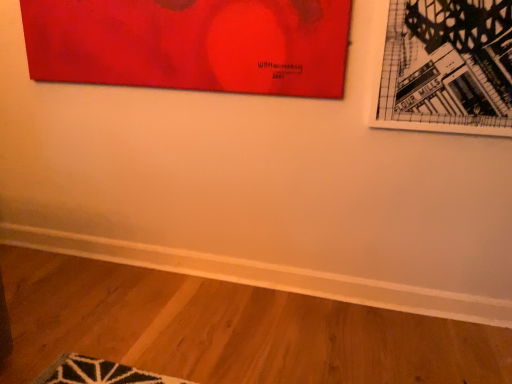
How much space does matte red painting at upper left, acting as the 2th picture frame starting from the right, occupy horizontally?

1.95 inches.

Locate an element on the screen. This screenshot has width=512, height=384. matte red painting at upper left, acting as the 2th picture frame starting from the right is located at coordinates (192, 44).

What do you see at coordinates (192, 44) in the screenshot? I see `matte red painting at upper left, acting as the 2th picture frame starting from the right` at bounding box center [192, 44].

Find the location of a particular element. The width and height of the screenshot is (512, 384). black paper picture frame at upper right, the second picture frame positioned from the left is located at coordinates (447, 67).

Image resolution: width=512 pixels, height=384 pixels. Describe the element at coordinates (447, 67) in the screenshot. I see `black paper picture frame at upper right, the second picture frame positioned from the left` at that location.

How much space does black paper picture frame at upper right, the second picture frame positioned from the left, occupy horizontally?

It is 1.82 inches.

Locate an element on the screen. This screenshot has width=512, height=384. matte red painting at upper left, the first picture frame in the left-to-right sequence is located at coordinates (192, 44).

Considering the relative positions of black paper picture frame at upper right, the second picture frame positioned from the left, and matte red painting at upper left, acting as the 2th picture frame starting from the right, in the image provided, is black paper picture frame at upper right, the second picture frame positioned from the left, to the right of matte red painting at upper left, acting as the 2th picture frame starting from the right, from the viewer's perspective?

Correct, you'll find black paper picture frame at upper right, the second picture frame positioned from the left, to the right of matte red painting at upper left, acting as the 2th picture frame starting from the right.

Is black paper picture frame at upper right, the second picture frame positioned from the left, in front of or behind matte red painting at upper left, the first picture frame in the left-to-right sequence, in the image?

Clearly, black paper picture frame at upper right, the second picture frame positioned from the left, is in front of matte red painting at upper left, the first picture frame in the left-to-right sequence.

Is point (400, 111) positioned after point (270, 37)?

No, it is in front of (270, 37).

From the image's perspective, which object appears higher, black paper picture frame at upper right, the second picture frame positioned from the left, or matte red painting at upper left, acting as the 2th picture frame starting from the right?

matte red painting at upper left, acting as the 2th picture frame starting from the right.

From a real-world perspective, which is physically above, black paper picture frame at upper right, which is the first picture frame from right to left, or matte red painting at upper left, acting as the 2th picture frame starting from the right?

matte red painting at upper left, acting as the 2th picture frame starting from the right, is physically above.

Which object is thinner, black paper picture frame at upper right, the second picture frame positioned from the left, or matte red painting at upper left, the first picture frame in the left-to-right sequence?

With smaller width is black paper picture frame at upper right, the second picture frame positioned from the left.

Considering the relative sizes of black paper picture frame at upper right, which is the first picture frame from right to left, and matte red painting at upper left, the first picture frame in the left-to-right sequence, in the image provided, is black paper picture frame at upper right, which is the first picture frame from right to left, taller than matte red painting at upper left, the first picture frame in the left-to-right sequence,?

Correct, black paper picture frame at upper right, which is the first picture frame from right to left, is much taller as matte red painting at upper left, the first picture frame in the left-to-right sequence.

Considering the relative sizes of black paper picture frame at upper right, which is the first picture frame from right to left, and matte red painting at upper left, the first picture frame in the left-to-right sequence, in the image provided, is black paper picture frame at upper right, which is the first picture frame from right to left, smaller than matte red painting at upper left, the first picture frame in the left-to-right sequence,?

Yes, black paper picture frame at upper right, which is the first picture frame from right to left, is smaller than matte red painting at upper left, the first picture frame in the left-to-right sequence.

Would you say black paper picture frame at upper right, the second picture frame positioned from the left, is outside matte red painting at upper left, acting as the 2th picture frame starting from the right?

Yes.

Looking at this image, is black paper picture frame at upper right, which is the first picture frame from right to left, touching matte red painting at upper left, acting as the 2th picture frame starting from the right?

They are not placed beside each other.

Is black paper picture frame at upper right, the second picture frame positioned from the left, aimed at matte red painting at upper left, acting as the 2th picture frame starting from the right?

No, black paper picture frame at upper right, the second picture frame positioned from the left, is not aimed at matte red painting at upper left, acting as the 2th picture frame starting from the right.

How distant is black paper picture frame at upper right, which is the first picture frame from right to left, from matte red painting at upper left, acting as the 2th picture frame starting from the right?

black paper picture frame at upper right, which is the first picture frame from right to left, and matte red painting at upper left, acting as the 2th picture frame starting from the right, are 16.94 inches apart from each other.

You are a GUI agent. You are given a task and a screenshot of the screen. Output one action in this format:
    pyautogui.click(x=<x>, y=<y>)
    Task: Click on the picture frame on the right of matte red painting at upper left, the first picture frame in the left-to-right sequence
    Image resolution: width=512 pixels, height=384 pixels.
    Given the screenshot: What is the action you would take?
    pyautogui.click(x=447, y=67)

Between matte red painting at upper left, the first picture frame in the left-to-right sequence, and black paper picture frame at upper right, which is the first picture frame from right to left, which one appears on the left side from the viewer's perspective?

matte red painting at upper left, the first picture frame in the left-to-right sequence, is more to the left.

Is matte red painting at upper left, acting as the 2th picture frame starting from the right, in front of or behind black paper picture frame at upper right, which is the first picture frame from right to left, in the image?

Clearly, matte red painting at upper left, acting as the 2th picture frame starting from the right, is behind black paper picture frame at upper right, which is the first picture frame from right to left.

Is point (329, 22) farther from camera compared to point (490, 128)?

That is True.

From the image's perspective, would you say matte red painting at upper left, acting as the 2th picture frame starting from the right, is positioned over black paper picture frame at upper right, the second picture frame positioned from the left?

Correct, matte red painting at upper left, acting as the 2th picture frame starting from the right, appears higher than black paper picture frame at upper right, the second picture frame positioned from the left, in the image.

From a real-world perspective, is matte red painting at upper left, the first picture frame in the left-to-right sequence, under black paper picture frame at upper right, which is the first picture frame from right to left?

No, from a real-world perspective, matte red painting at upper left, the first picture frame in the left-to-right sequence, is not beneath black paper picture frame at upper right, which is the first picture frame from right to left.

Which object is wider, matte red painting at upper left, the first picture frame in the left-to-right sequence, or black paper picture frame at upper right, the second picture frame positioned from the left?

With larger width is matte red painting at upper left, the first picture frame in the left-to-right sequence.

Considering the sizes of objects matte red painting at upper left, acting as the 2th picture frame starting from the right, and black paper picture frame at upper right, the second picture frame positioned from the left, in the image provided, who is taller, matte red painting at upper left, acting as the 2th picture frame starting from the right, or black paper picture frame at upper right, the second picture frame positioned from the left,?

Standing taller between the two is black paper picture frame at upper right, the second picture frame positioned from the left.

Does matte red painting at upper left, acting as the 2th picture frame starting from the right, have a larger size compared to black paper picture frame at upper right, which is the first picture frame from right to left?

Yes, matte red painting at upper left, acting as the 2th picture frame starting from the right, is bigger than black paper picture frame at upper right, which is the first picture frame from right to left.

Is matte red painting at upper left, acting as the 2th picture frame starting from the right, spatially inside black paper picture frame at upper right, which is the first picture frame from right to left, or outside of it?

matte red painting at upper left, acting as the 2th picture frame starting from the right, is not enclosed by black paper picture frame at upper right, which is the first picture frame from right to left.

Is matte red painting at upper left, the first picture frame in the left-to-right sequence, not close to black paper picture frame at upper right, the second picture frame positioned from the left?

No, matte red painting at upper left, the first picture frame in the left-to-right sequence, is not far away from black paper picture frame at upper right, the second picture frame positioned from the left.

Could you tell me if matte red painting at upper left, acting as the 2th picture frame starting from the right, is facing black paper picture frame at upper right, which is the first picture frame from right to left?

No, matte red painting at upper left, acting as the 2th picture frame starting from the right, is not aimed at black paper picture frame at upper right, which is the first picture frame from right to left.

How different are the orientations of matte red painting at upper left, acting as the 2th picture frame starting from the right, and black paper picture frame at upper right, which is the first picture frame from right to left, in degrees?

1.44 degrees.

Could you measure the distance between matte red painting at upper left, the first picture frame in the left-to-right sequence, and black paper picture frame at upper right, the second picture frame positioned from the left?

matte red painting at upper left, the first picture frame in the left-to-right sequence, and black paper picture frame at upper right, the second picture frame positioned from the left, are 16.94 inches apart.

Image resolution: width=512 pixels, height=384 pixels. In order to click on picture frame that appears on the left of black paper picture frame at upper right, the second picture frame positioned from the left in this screenshot , I will do `click(192, 44)`.

You are a GUI agent. You are given a task and a screenshot of the screen. Output one action in this format:
    pyautogui.click(x=<x>, y=<y>)
    Task: Click on the picture frame above the black paper picture frame at upper right, the second picture frame positioned from the left (from a real-world perspective)
    The width and height of the screenshot is (512, 384).
    Given the screenshot: What is the action you would take?
    tap(192, 44)

This screenshot has height=384, width=512. I want to click on picture frame on the right of matte red painting at upper left, the first picture frame in the left-to-right sequence, so click(447, 67).